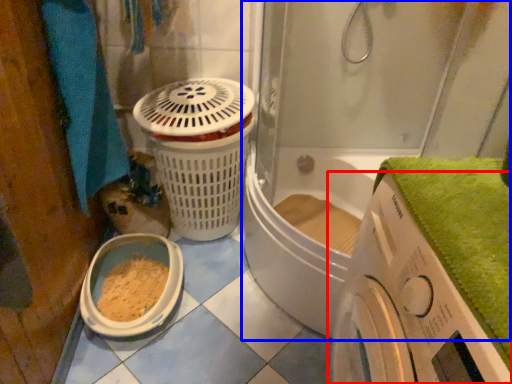
Question: Which object is closer to the camera taking this photo, washing machine (highlighted by a red box) or shower door (highlighted by a blue box)?

Choices:
 (A) washing machine
 (B) shower door

Answer: (A)